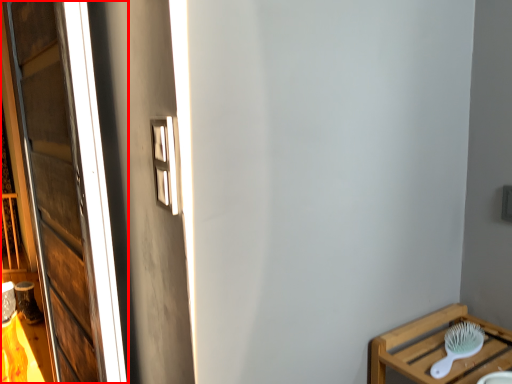
Question: From the image, what is the correct spatial relationship of window (annotated by the red box) in relation to brush?

Choices:
 (A) right
 (B) left

Answer: (B)